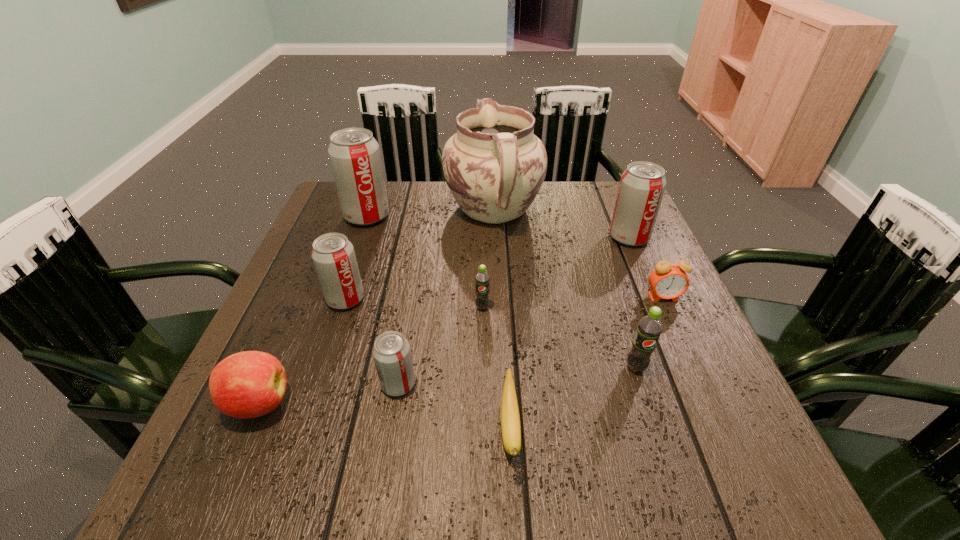
Find the location of a particular element. This screenshot has height=540, width=960. the fourth object from left to right is located at coordinates (391, 351).

Find the location of `the third soda can from left to right`. the third soda can from left to right is located at coordinates (391, 351).

Where is `pink alarm clock`? pink alarm clock is located at coordinates pyautogui.click(x=668, y=280).

The width and height of the screenshot is (960, 540). What are the coordinates of `red apple` in the screenshot? It's located at [x=249, y=384].

At what (x,y) coordinates should I click in order to perform the action: click on banana. Please return your answer as a coordinate pair (x, y). The width and height of the screenshot is (960, 540). Looking at the image, I should click on (510, 420).

This screenshot has width=960, height=540. What are the coordinates of `yellow banana` in the screenshot? It's located at (510, 420).

Find the location of a particular element. free space located on the front of the tallest soda can is located at coordinates (327, 329).

Identify the location of free spot located 0.180m on the left of the third tallest object. The image size is (960, 540). (540, 237).

In order to click on free region located 0.260m on the right of the third biggest gray soda can in this screenshot , I will do `click(482, 299)`.

This screenshot has height=540, width=960. I want to click on vacant space located on the front label of the second soda can from right to left, so click(x=648, y=405).